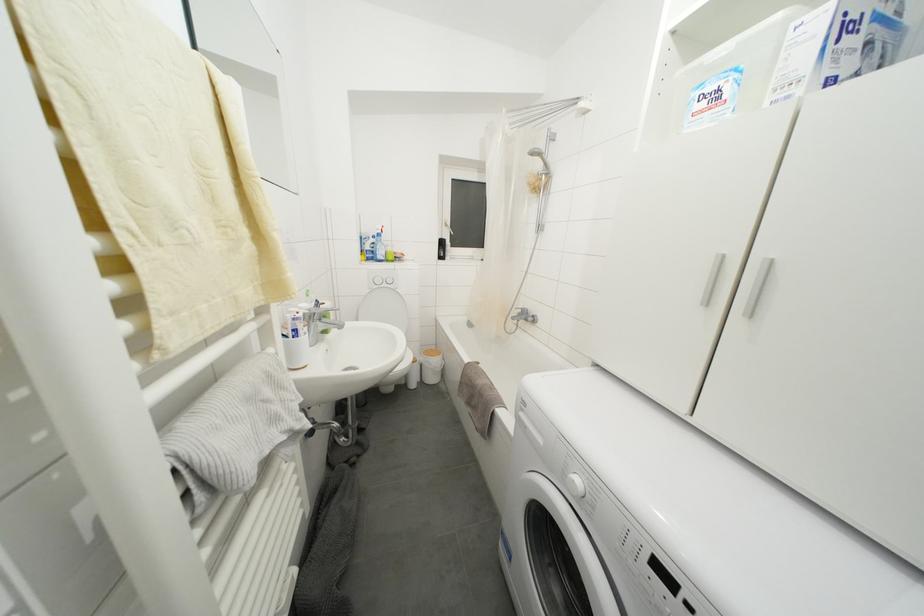
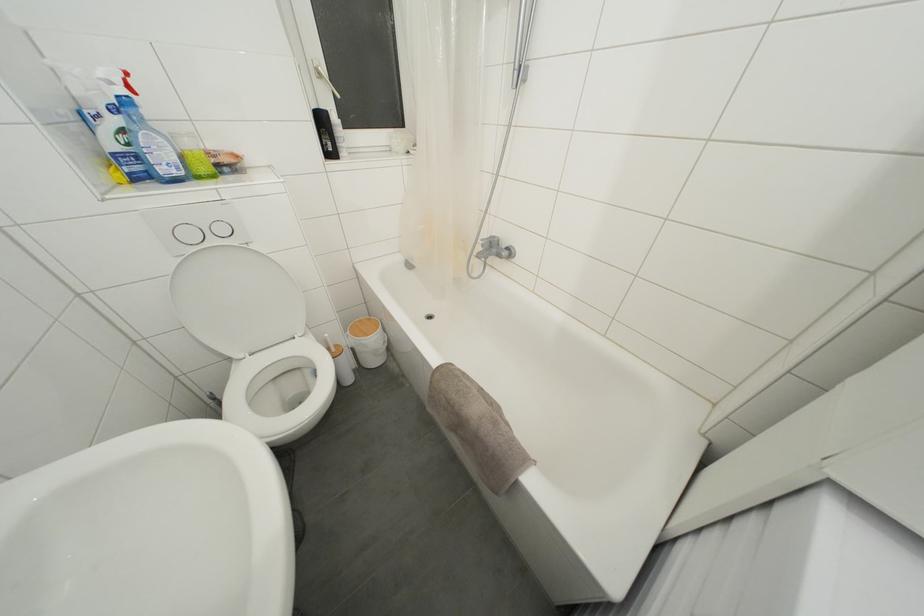
In the second image, find the point that corresponds to (451,229) in the first image.

(323, 79)